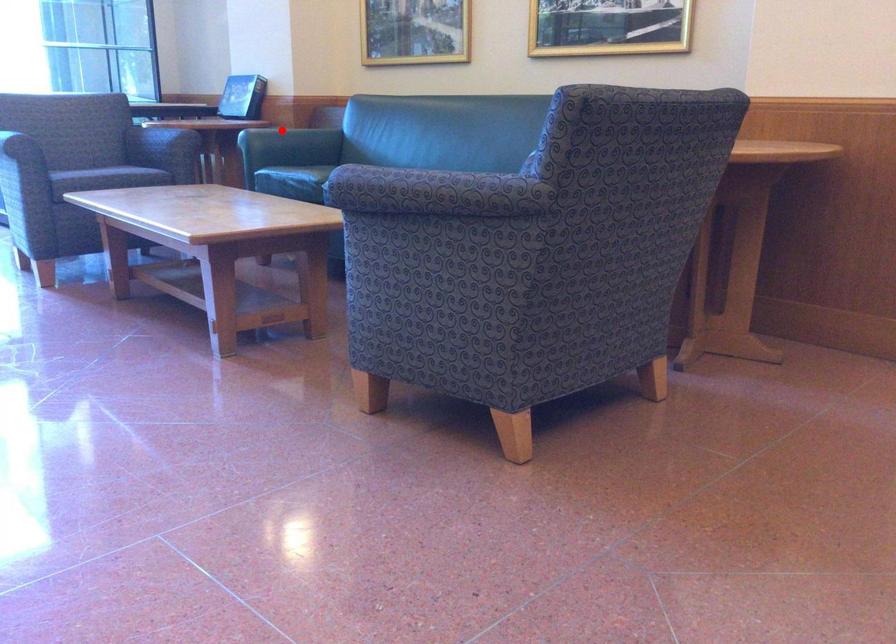
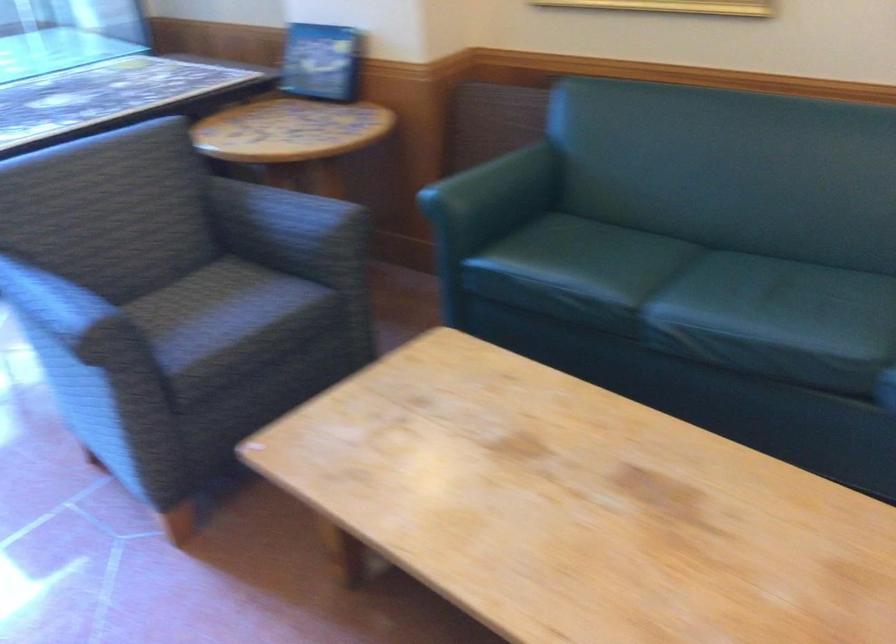
Question: I am providing you with two images of the same scene from different viewpoints. Given a red point in image1, look at the same physical point in image2. Is it:

Choices:
 (A) Closer to the viewpoint
 (B) Farther from the viewpoint

Answer: (A)